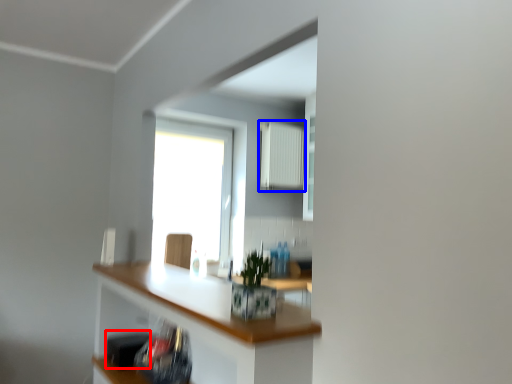
Question: Which object is further to the camera taking this photo, appliance (highlighted by a red box) or radiator (highlighted by a blue box)?

Choices:
 (A) appliance
 (B) radiator

Answer: (B)